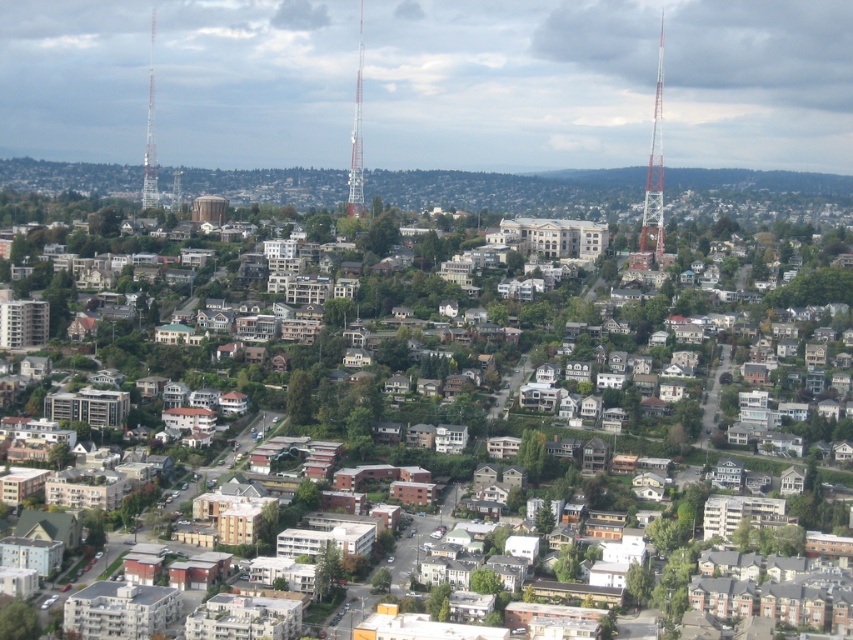
The image size is (853, 640). Describe the element at coordinates (653, 182) in the screenshot. I see `red painted metal tower at right` at that location.

Is red painted metal tower at right to the right of white painted metal tower at center from the viewer's perspective?

Indeed, red painted metal tower at right is positioned on the right side of white painted metal tower at center.

Between point (657, 177) and point (357, 150), which one is positioned in front?

Point (357, 150)

I want to click on red painted metal tower at right, so click(653, 182).

Does red painted metal tower at right have a greater width compared to metallic silver tower at left?

Yes, red painted metal tower at right is wider than metallic silver tower at left.

Identify the location of red painted metal tower at right. (653, 182).

Does point (358, 176) come closer to viewer compared to point (152, 173)?

Yes, it is in front of point (152, 173).

How distant is white painted metal tower at center from metallic silver tower at left?

white painted metal tower at center is 236.39 feet away from metallic silver tower at left.

Image resolution: width=853 pixels, height=640 pixels. I want to click on white painted metal tower at center, so click(x=357, y=140).